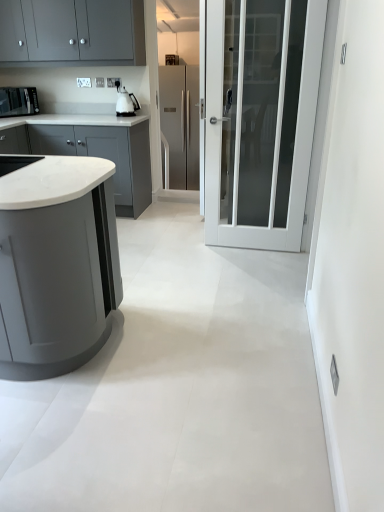
Question: Could you tell me if white glossy kettle at upper center, the 1th kitchen appliance in the right-to-left sequence, is turned towards white marble countertop at left, which is the 2th cabinetry in bottom-to-top order?

Choices:
 (A) no
 (B) yes

Answer: (A)

Question: Is white glossy kettle at upper center, the 1th kitchen appliance in the right-to-left sequence, not close to white marble countertop at left, acting as the first cabinetry starting from the back?

Choices:
 (A) no
 (B) yes

Answer: (A)

Question: Is white glossy kettle at upper center, which is the 2th kitchen appliance from left to right, touching white marble countertop at left, which is counted as the second cabinetry, starting from the top?

Choices:
 (A) no
 (B) yes

Answer: (A)

Question: Is white glossy kettle at upper center, the 1th kitchen appliance in the right-to-left sequence, closer to the viewer compared to white marble countertop at left, acting as the first cabinetry starting from the back?

Choices:
 (A) no
 (B) yes

Answer: (A)

Question: Would you say white marble countertop at left, which is counted as the second cabinetry, starting from the top, is part of white glossy kettle at upper center, the 1th kitchen appliance in the right-to-left sequence,'s contents?

Choices:
 (A) no
 (B) yes

Answer: (A)

Question: From a real-world perspective, is white glossy kettle at upper center, the 1th kitchen appliance in the right-to-left sequence, over white marble countertop at left, acting as the first cabinetry starting from the back?

Choices:
 (A) yes
 (B) no

Answer: (A)

Question: Is matte gray cabinet at left, which appears as the 1th cabinetry when viewed from the front, looking in the opposite direction of white glossy kettle at upper center, the 1th kitchen appliance in the right-to-left sequence?

Choices:
 (A) yes
 (B) no

Answer: (B)

Question: From the image's perspective, is matte gray cabinet at left, which appears as the 1th cabinetry when viewed from the front, above white glossy kettle at upper center, the 1th kitchen appliance in the right-to-left sequence?

Choices:
 (A) no
 (B) yes

Answer: (A)

Question: From a real-world perspective, is matte gray cabinet at left, the 3th cabinetry viewed from the back, positioned over white glossy kettle at upper center, the 1th kitchen appliance in the right-to-left sequence, based on gravity?

Choices:
 (A) yes
 (B) no

Answer: (B)

Question: Is matte gray cabinet at left, which appears as the 1th cabinetry when ordered from the bottom, at the left side of white glossy kettle at upper center, the 1th kitchen appliance in the right-to-left sequence?

Choices:
 (A) yes
 (B) no

Answer: (A)

Question: Is matte gray cabinet at left, the 3th cabinetry viewed from the back, next to white glossy kettle at upper center, the 1th kitchen appliance in the right-to-left sequence?

Choices:
 (A) no
 (B) yes

Answer: (A)

Question: Can you confirm if matte gray cabinet at left, which appears as the 1th cabinetry when viewed from the front, is bigger than white glossy kettle at upper center, which is the 2th kitchen appliance from left to right?

Choices:
 (A) no
 (B) yes

Answer: (B)

Question: Is matte gray cabinets at upper left, positioned as the second cabinetry in front-to-back order, not near stainless steel refrigerator at center?

Choices:
 (A) yes
 (B) no

Answer: (A)